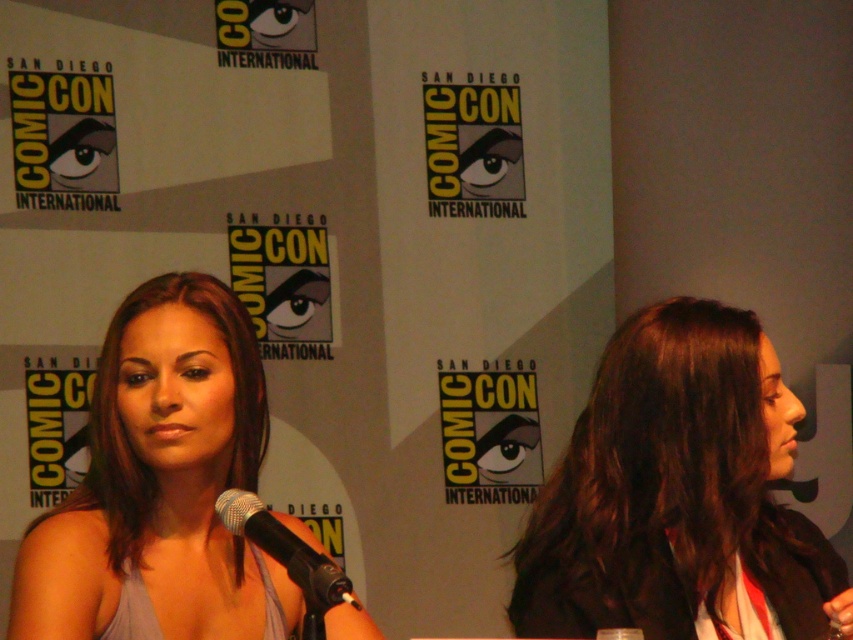
Question: Among these points, which one is farthest from the camera?

Choices:
 (A) (219, 394)
 (B) (350, 600)

Answer: (A)

Question: Is dark brown hair at center above black metallic microphone at center?

Choices:
 (A) yes
 (B) no

Answer: (A)

Question: Which object is the farthest from the black metallic microphone at center?

Choices:
 (A) matte gray dress at center
 (B) dark brown hair at center

Answer: (B)

Question: Is dark brown hair at center thinner than matte gray dress at center?

Choices:
 (A) no
 (B) yes

Answer: (B)

Question: Considering the real-world distances, which object is closest to the matte gray dress at center?

Choices:
 (A) dark brown hair at center
 (B) black metallic microphone at center

Answer: (B)

Question: Where is dark brown hair at center located in relation to matte gray dress at center in the image?

Choices:
 (A) left
 (B) right

Answer: (B)